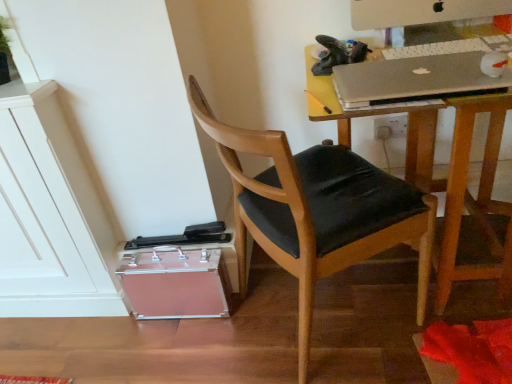
Question: Does white plastic computer monitor at upper right lie behind silver metallic laptop at upper right?

Choices:
 (A) yes
 (B) no

Answer: (A)

Question: Is white plastic computer monitor at upper right surrounding silver metallic laptop at upper right?

Choices:
 (A) no
 (B) yes

Answer: (A)

Question: Considering the relative sizes of white plastic computer monitor at upper right and silver metallic laptop at upper right in the image provided, is white plastic computer monitor at upper right shorter than silver metallic laptop at upper right?

Choices:
 (A) no
 (B) yes

Answer: (A)

Question: Is white plastic computer monitor at upper right beside silver metallic laptop at upper right?

Choices:
 (A) no
 (B) yes

Answer: (A)

Question: Can you confirm if white plastic computer monitor at upper right is wider than silver metallic laptop at upper right?

Choices:
 (A) no
 (B) yes

Answer: (A)

Question: Does white plastic computer monitor at upper right have a greater height compared to silver metallic laptop at upper right?

Choices:
 (A) yes
 (B) no

Answer: (A)

Question: Does wooden chair with black cushion at center have a lesser width compared to white plastic computer monitor at upper right?

Choices:
 (A) no
 (B) yes

Answer: (A)

Question: Can you confirm if wooden chair with black cushion at center is positioned to the right of white plastic computer monitor at upper right?

Choices:
 (A) no
 (B) yes

Answer: (A)

Question: Is wooden chair with black cushion at center taller than white plastic computer monitor at upper right?

Choices:
 (A) yes
 (B) no

Answer: (A)

Question: Considering the relative sizes of wooden chair with black cushion at center and white plastic computer monitor at upper right in the image provided, is wooden chair with black cushion at center smaller than white plastic computer monitor at upper right?

Choices:
 (A) no
 (B) yes

Answer: (A)

Question: Considering the relative positions of wooden chair with black cushion at center and white plastic computer monitor at upper right in the image provided, is wooden chair with black cushion at center behind white plastic computer monitor at upper right?

Choices:
 (A) no
 (B) yes

Answer: (A)

Question: From a real-world perspective, is wooden chair with black cushion at center on top of white plastic computer monitor at upper right?

Choices:
 (A) yes
 (B) no

Answer: (B)

Question: From a real-world perspective, is white plastic keyboard at upper right below metallic silver desk at upper right?

Choices:
 (A) yes
 (B) no

Answer: (B)